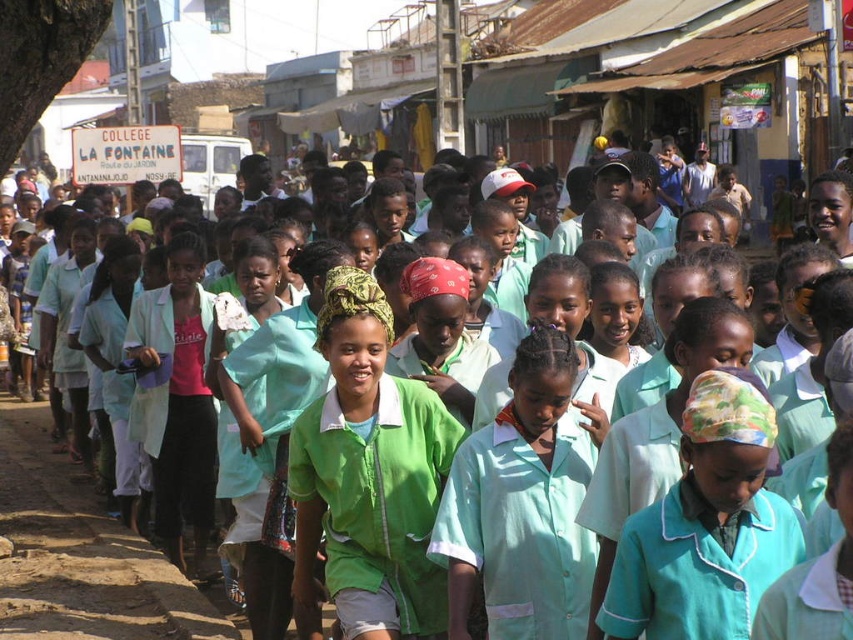
You are a tailor who needs to determine which item requires more fabric between the green fabric shirt at center and the green fabric headscarf at center. Based on the scene, which one would need more fabric?

The green fabric shirt at center requires more fabric because it is larger in size than the green fabric headscarf at center.

From the picture: You are a photographer trying to capture the children in the scene. The green fabric shirt at center is located at point 0.747 on the x axis and 0.433 on the y axis. To ensure all children are in frame, where should you position your camera?

The green fabric shirt at center is located at point 0.747 on the x axis and 0.433 on the y axis, so positioning the camera centered around these coordinates will help ensure all children are in frame.

From the picture: You are a photographer trying to capture a closeup of the green fabric shirt at center without including the green fabric headscarf at center in the frame. Based on their positions, is this possible?

The green fabric shirt at center is above the green fabric headscarf at center, so yes, the photographer can focus on the green fabric shirt at center while excluding the green fabric headscarf at center by adjusting the camera angle downward.